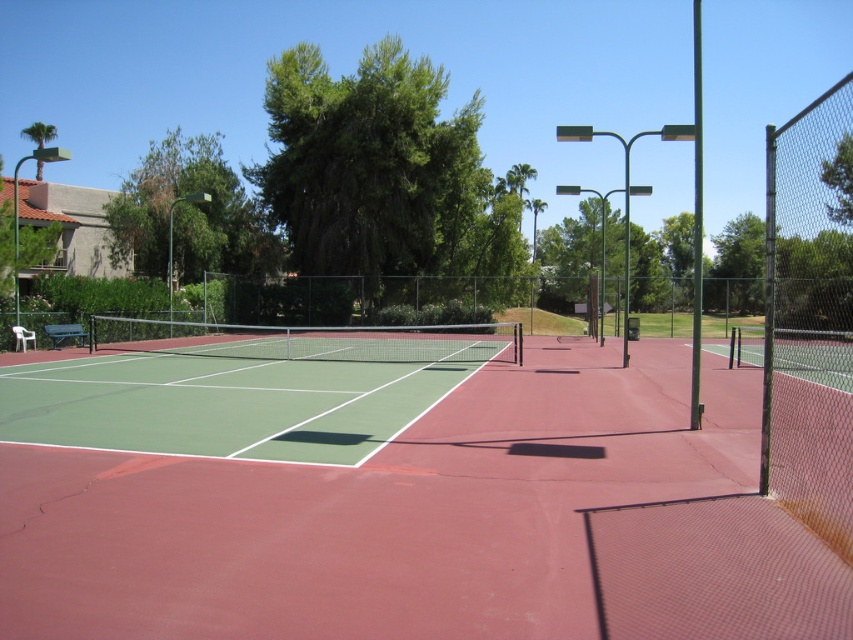
You are standing at the center of the green rubber tennis court at center. If you walk straight ahead, will you exit the court area immediately?

Result: The position of green rubber tennis court at center is at point (434, 524), so if you walk straight ahead from the center, you will exit the court area immediately.

You are a tennis player standing at the baseline of the green section. You want to hit a ball to the red section. There is a green leafy tree at upper right. Can you safely hit the ball over the net and into the red section without the ball hitting the tree?

The green leafy tree at upper right is 4.41 meters away from the baseline. Since the court is divided into two sections by the net, and the red section is on the other side, the distance between the baseline and the tree is sufficient to safely hit the ball over the net into the red section without hitting the tree.